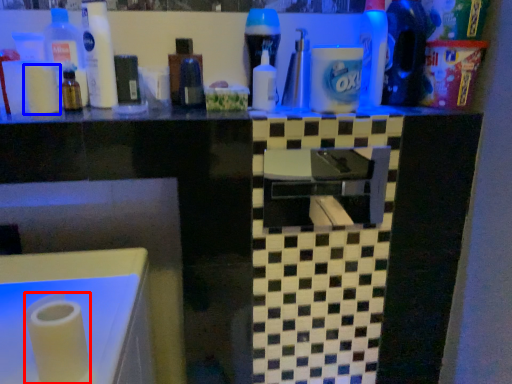
Question: Which point is closer to the camera, paper towel (highlighted by a red box) or toilet paper (highlighted by a blue box)?

Choices:
 (A) paper towel
 (B) toilet paper

Answer: (A)